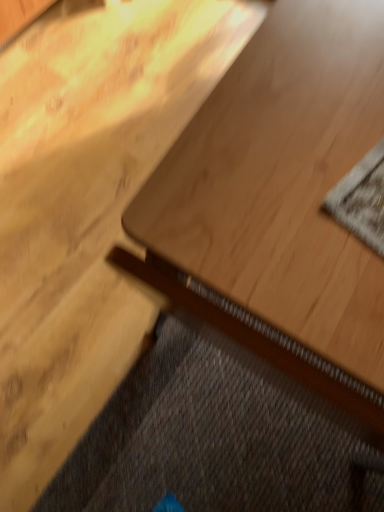
Describe the element at coordinates (278, 203) in the screenshot. I see `light wood table at center` at that location.

Describe the element at coordinates (361, 199) in the screenshot. The height and width of the screenshot is (512, 384). I see `textured gray mat at upper right` at that location.

Describe the element at coordinates (210, 435) in the screenshot. This screenshot has width=384, height=512. I see `dark gray textured doormat at lower left` at that location.

Identify the location of light wood table at center. The image size is (384, 512). (278, 203).

What's the angular difference between dark gray textured doormat at lower left and textured gray mat at upper right's facing directions?

The facing directions of dark gray textured doormat at lower left and textured gray mat at upper right are 10.4 degrees apart.

From the image's perspective, which object appears higher, dark gray textured doormat at lower left or textured gray mat at upper right?

textured gray mat at upper right appears higher in the image.

From a real-world perspective, is dark gray textured doormat at lower left positioned above or below textured gray mat at upper right?

dark gray textured doormat at lower left is below textured gray mat at upper right.

Does dark gray textured doormat at lower left turn towards textured gray mat at upper right?

No, dark gray textured doormat at lower left is not facing towards textured gray mat at upper right.

From a real-world perspective, is light wood table at center physically located above or below dark gray textured doormat at lower left?

From a real-world perspective, light wood table at center is physically above dark gray textured doormat at lower left.

Consider the image. Can you confirm if light wood table at center is wider than dark gray textured doormat at lower left?

Yes, light wood table at center is wider than dark gray textured doormat at lower left.

Would you say light wood table at center is inside or outside dark gray textured doormat at lower left?

light wood table at center is spatially situated outside dark gray textured doormat at lower left.

Are light wood table at center and dark gray textured doormat at lower left far apart?

Actually, light wood table at center and dark gray textured doormat at lower left are a little close together.

From the image's perspective, is light wood table at center on textured gray mat at upper right?

No, from the image's perspective, light wood table at center is not over textured gray mat at upper right.

Can you confirm if light wood table at center is wider than textured gray mat at upper right?

Indeed, light wood table at center has a greater width compared to textured gray mat at upper right.

Considering the sizes of objects light wood table at center and textured gray mat at upper right in the image provided, who is taller, light wood table at center or textured gray mat at upper right?

light wood table at center is taller.

Can we say light wood table at center lies outside textured gray mat at upper right?

light wood table at center is positioned outside textured gray mat at upper right.

Is textured gray mat at upper right surrounding dark gray textured doormat at lower left?

That's incorrect, dark gray textured doormat at lower left is not inside textured gray mat at upper right.

From a real-world perspective, who is located higher, textured gray mat at upper right or dark gray textured doormat at lower left?

textured gray mat at upper right, from a real-world perspective.

Which of these two, textured gray mat at upper right or dark gray textured doormat at lower left, is thinner?

textured gray mat at upper right.

Is textured gray mat at upper right with light wood table at center?

Yes, the surface of textured gray mat at upper right is in contact with light wood table at center.

From the picture: Is textured gray mat at upper right facing towards light wood table at center?

Yes, textured gray mat at upper right is turned towards light wood table at center.

Could light wood table at center be considered to be inside textured gray mat at upper right?

No, light wood table at center is not inside textured gray mat at upper right.

From the image's perspective, would you say dark gray textured doormat at lower left is positioned over light wood table at center?

Actually, dark gray textured doormat at lower left appears below light wood table at center in the image.

Can you confirm if dark gray textured doormat at lower left is positioned to the right of light wood table at center?

No.

Considering the points (239, 372) and (158, 170), which point is in front, point (239, 372) or point (158, 170)?

Positioned in front is point (158, 170).

Can you confirm if dark gray textured doormat at lower left is smaller than light wood table at center?

Indeed, dark gray textured doormat at lower left has a smaller size compared to light wood table at center.

This screenshot has width=384, height=512. I want to click on doormat that appears below the textured gray mat at upper right (from a real-world perspective), so click(210, 435).

You are a GUI agent. You are given a task and a screenshot of the screen. Output one action in this format:
    pyautogui.click(x=<x>, y=<y>)
    Task: Click on the doormat located behind the light wood table at center
    
    Given the screenshot: What is the action you would take?
    pyautogui.click(x=210, y=435)

Considering their positions, is textured gray mat at upper right positioned further to dark gray textured doormat at lower left than light wood table at center?

Among the two, textured gray mat at upper right is located further to dark gray textured doormat at lower left.

Based on their spatial positions, is dark gray textured doormat at lower left or textured gray mat at upper right further from light wood table at center?

dark gray textured doormat at lower left.

From the picture: When comparing their distances from textured gray mat at upper right, does light wood table at center or dark gray textured doormat at lower left seem closer?

Among the two, light wood table at center is located nearer to textured gray mat at upper right.

When comparing their distances from light wood table at center, does textured gray mat at upper right or dark gray textured doormat at lower left seem further?

Based on the image, dark gray textured doormat at lower left appears to be further to light wood table at center.

Estimate the real-world distances between objects in this image. Which object is closer to dark gray textured doormat at lower left, light wood table at center or textured gray mat at upper right?

light wood table at center lies closer to dark gray textured doormat at lower left than the other object.

Which object lies nearer to the anchor point textured gray mat at upper right, dark gray textured doormat at lower left or light wood table at center?

The object closer to textured gray mat at upper right is light wood table at center.

Locate an element on the screen. table between textured gray mat at upper right and dark gray textured doormat at lower left from top to bottom is located at coordinates (278, 203).